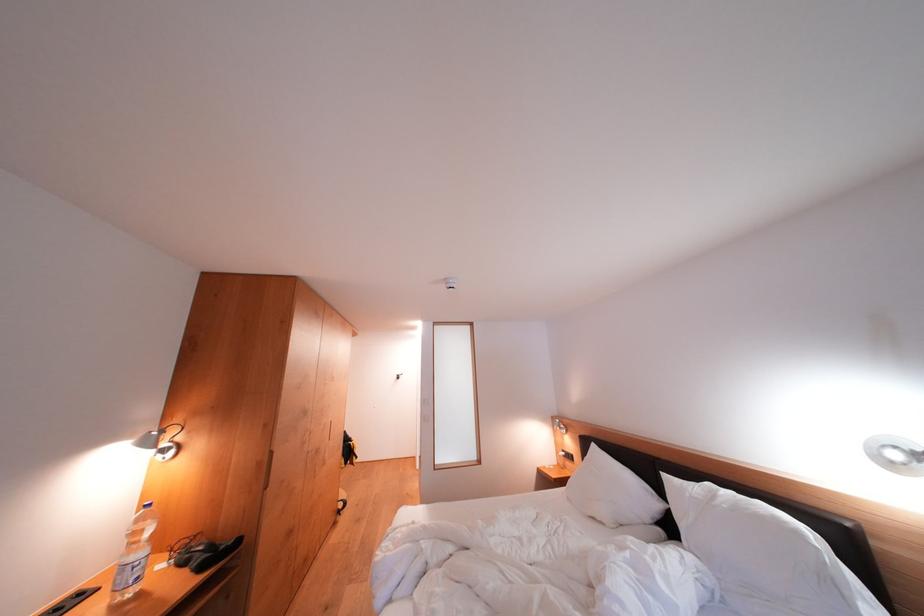
The image size is (924, 616). I want to click on black wall hook, so click(x=397, y=377).